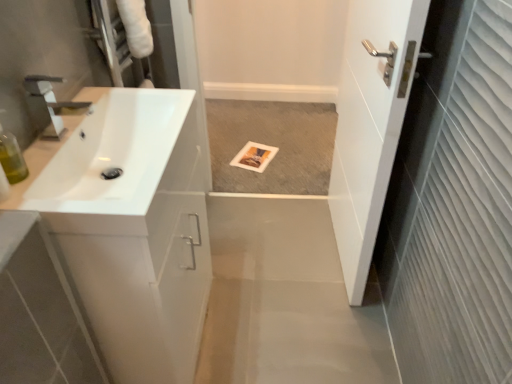
Where is `free space in front of white glossy door at right`? The image size is (512, 384). free space in front of white glossy door at right is located at coordinates (324, 321).